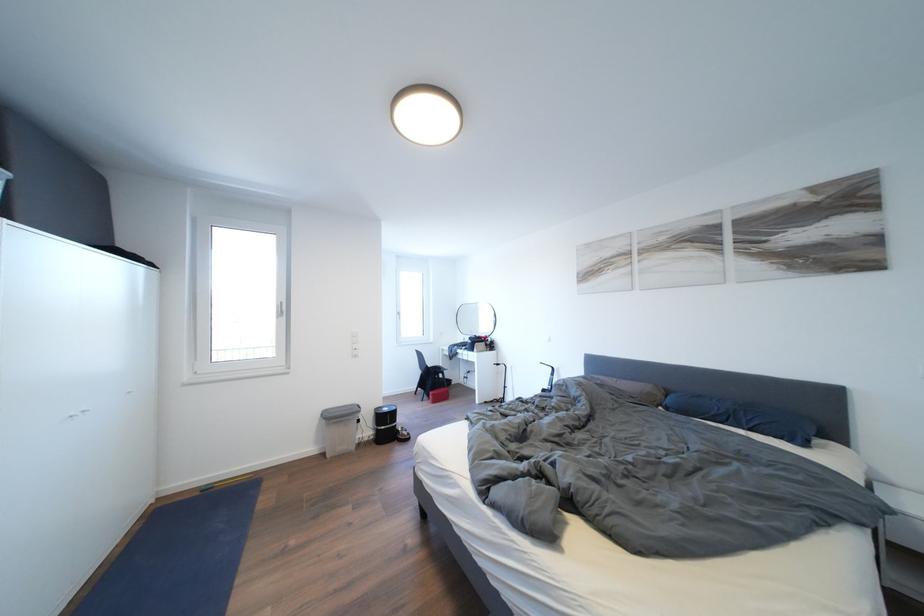
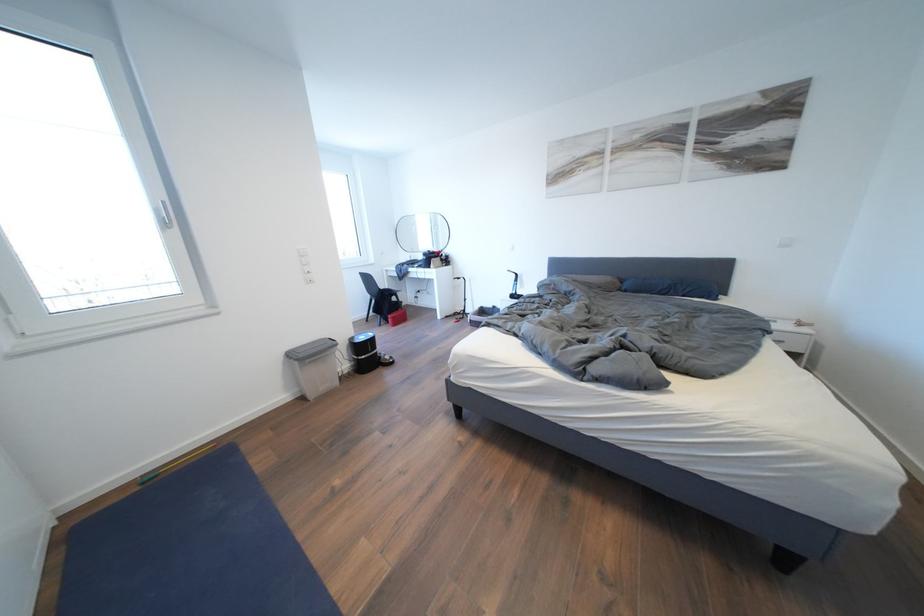
Consider the image. How did the camera likely rotate?

The camera rotated toward right-down.